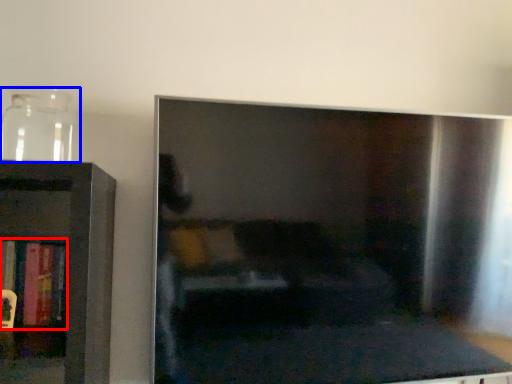
Question: Which point is further to the camera, book (highlighted by a red box) or glass vase (highlighted by a blue box)?

Choices:
 (A) book
 (B) glass vase

Answer: (A)